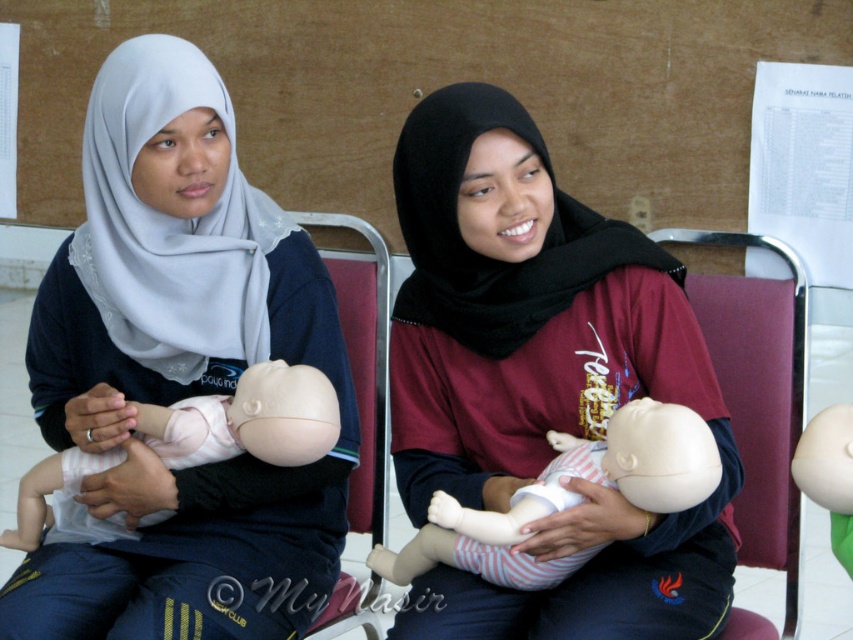
Does point (651, 484) come in front of point (804, 476)?

No, (651, 484) is further to viewer.

Can you confirm if white matte baby doll at center is positioned above matte plastic baby doll at center?

Actually, white matte baby doll at center is below matte plastic baby doll at center.

This screenshot has height=640, width=853. Find the location of `white matte baby doll at center`. white matte baby doll at center is located at coordinates (566, 497).

At what (x,y) coordinates should I click in order to perform the action: click on pink matte baby doll at center. Please return your answer as a coordinate pair (x, y). Looking at the image, I should click on (247, 419).

Between pink matte baby doll at center and matte plastic baby doll at center, which one is positioned lower?

pink matte baby doll at center is below.

Image resolution: width=853 pixels, height=640 pixels. Identify the location of pink matte baby doll at center. (247, 419).

How distant is matte white hijab at upper left from matte black baby doll at center?

matte white hijab at upper left is 39.03 centimeters away from matte black baby doll at center.

Describe the element at coordinates (178, 372) in the screenshot. I see `matte white hijab at upper left` at that location.

This screenshot has width=853, height=640. In order to click on matte white hijab at upper left in this screenshot , I will do `click(178, 372)`.